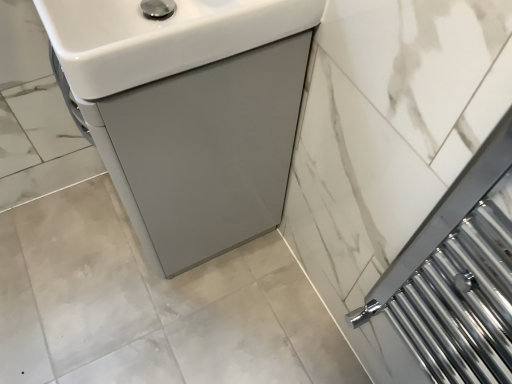
Question: Considering the relative sizes of white glossy sink at upper left, arranged as the 1th sink when viewed from the front, and white glossy sink at center, the 2th sink when ordered from front to back, in the image provided, is white glossy sink at upper left, arranged as the 1th sink when viewed from the front, wider than white glossy sink at center, the 2th sink when ordered from front to back,?

Choices:
 (A) no
 (B) yes

Answer: (A)

Question: Can you confirm if white glossy sink at upper left, arranged as the 1th sink when viewed from the front, is thinner than white glossy sink at center, the 2th sink when ordered from front to back?

Choices:
 (A) no
 (B) yes

Answer: (B)

Question: Is white glossy sink at center, the first sink viewed from the back, a part of white glossy sink at upper left, arranged as the 1th sink when viewed from the front?

Choices:
 (A) no
 (B) yes

Answer: (A)

Question: Considering the relative positions of white glossy sink at upper left, arranged as the 1th sink when viewed from the front, and white glossy sink at center, the first sink viewed from the back, in the image provided, is white glossy sink at upper left, arranged as the 1th sink when viewed from the front, in front of white glossy sink at center, the first sink viewed from the back,?

Choices:
 (A) yes
 (B) no

Answer: (A)

Question: From the image's perspective, does white glossy sink at upper left, which ranks as the 2th sink in back-to-front order, appear lower than white glossy sink at center, the 2th sink when ordered from front to back?

Choices:
 (A) yes
 (B) no

Answer: (B)

Question: Does white glossy sink at upper left, which ranks as the 2th sink in back-to-front order, turn towards white glossy sink at center, the first sink viewed from the back?

Choices:
 (A) yes
 (B) no

Answer: (B)

Question: Can we say white glossy sink at center, the first sink viewed from the back, lies outside white glossy sink at upper left, arranged as the 1th sink when viewed from the front?

Choices:
 (A) yes
 (B) no

Answer: (A)

Question: Is the depth of white glossy sink at center, the first sink viewed from the back, less than that of white glossy sink at upper left, arranged as the 1th sink when viewed from the front?

Choices:
 (A) yes
 (B) no

Answer: (B)

Question: Considering the relative sizes of white glossy sink at center, the first sink viewed from the back, and white glossy sink at upper left, which ranks as the 2th sink in back-to-front order, in the image provided, is white glossy sink at center, the first sink viewed from the back, wider than white glossy sink at upper left, which ranks as the 2th sink in back-to-front order,?

Choices:
 (A) yes
 (B) no

Answer: (A)

Question: Is white glossy sink at center, the 2th sink when ordered from front to back, placed right next to white glossy sink at upper left, arranged as the 1th sink when viewed from the front?

Choices:
 (A) no
 (B) yes

Answer: (A)

Question: Considering the relative positions of white glossy sink at center, the 2th sink when ordered from front to back, and white glossy sink at upper left, which ranks as the 2th sink in back-to-front order, in the image provided, is white glossy sink at center, the 2th sink when ordered from front to back, behind white glossy sink at upper left, which ranks as the 2th sink in back-to-front order,?

Choices:
 (A) no
 (B) yes

Answer: (B)

Question: Can you confirm if white glossy sink at center, the 2th sink when ordered from front to back, is smaller than white glossy sink at upper left, which ranks as the 2th sink in back-to-front order?

Choices:
 (A) yes
 (B) no

Answer: (B)

Question: Is white glossy sink at center, the 2th sink when ordered from front to back, situated inside white glossy sink at upper left, which ranks as the 2th sink in back-to-front order, or outside?

Choices:
 (A) inside
 (B) outside

Answer: (B)